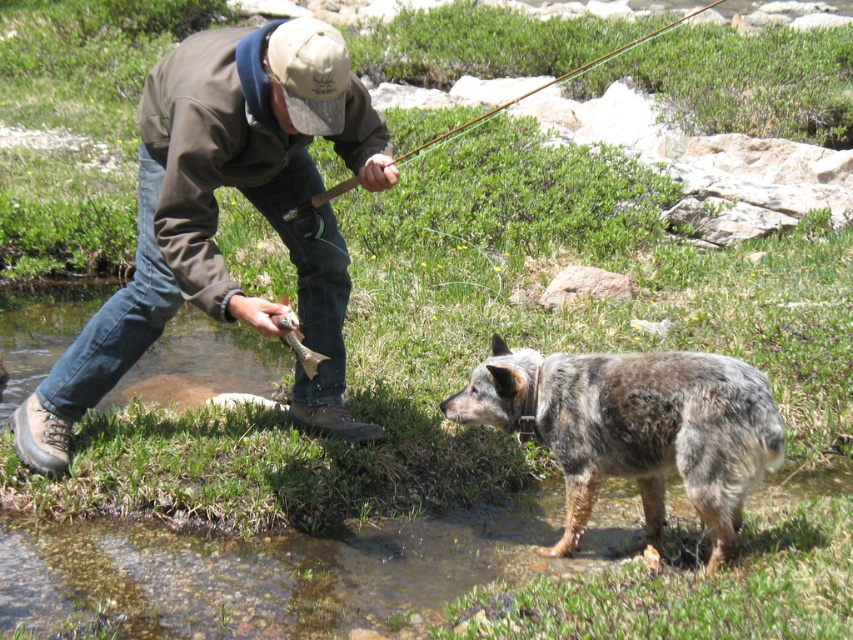
Question: Which point is farther from the camera taking this photo?

Choices:
 (A) (206, 156)
 (B) (286, 332)
 (C) (410, 148)

Answer: (C)

Question: Is speckled fur dog at lower right positioned in front of shiny silver fish at center?

Choices:
 (A) yes
 (B) no

Answer: (A)

Question: Is brown fleece jacket at center positioned at the back of shiny silver fish at center?

Choices:
 (A) no
 (B) yes

Answer: (A)

Question: Based on their relative distances, which object is farther from the brown fleece jacket at center?

Choices:
 (A) shiny silver fish at center
 (B) speckled fur dog at lower right

Answer: (B)

Question: Is brown fleece jacket at center thinner than shiny silver fish at center?

Choices:
 (A) yes
 (B) no

Answer: (B)

Question: Which point is closer to the camera?

Choices:
 (A) shiny silver fish at center
 (B) wooden fishing rod at upper center
 (C) brown fleece jacket at center
 (D) speckled fur dog at lower right

Answer: (C)